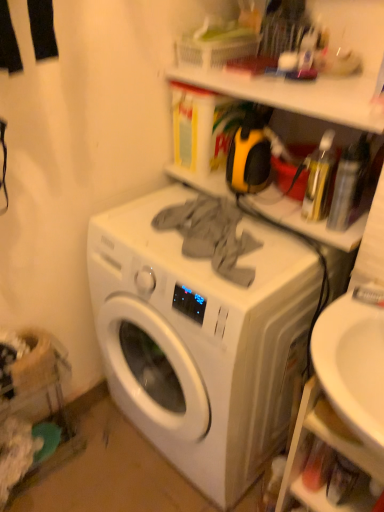
Question: Is white plastic shelf at lower right, the 3th shelf viewed from the top, directly adjacent to matte plastic shelf at upper center, which is counted as the second shelf, starting from the bottom?

Choices:
 (A) no
 (B) yes

Answer: (A)

Question: Does white plastic shelf at lower right, arranged as the 1th shelf when ordered from the bottom, turn towards matte plastic shelf at upper center, the 2th shelf positioned from the top?

Choices:
 (A) yes
 (B) no

Answer: (B)

Question: From a real-world perspective, is white plastic shelf at lower right, the 3th shelf viewed from the top, located higher than matte plastic shelf at upper center, the 2th shelf positioned from the top?

Choices:
 (A) yes
 (B) no

Answer: (B)

Question: Is there a large distance between white plastic shelf at lower right, arranged as the 1th shelf when ordered from the bottom, and matte plastic shelf at upper center, the 2th shelf positioned from the top?

Choices:
 (A) no
 (B) yes

Answer: (A)

Question: From the image's perspective, is white plastic shelf at lower right, arranged as the 1th shelf when ordered from the bottom, under matte plastic shelf at upper center, the 2th shelf positioned from the top?

Choices:
 (A) no
 (B) yes

Answer: (B)

Question: Considering the positions of white matte washing machine at center and white plastic shelf at lower right, arranged as the 1th shelf when ordered from the bottom, in the image, is white matte washing machine at center wider or thinner than white plastic shelf at lower right, arranged as the 1th shelf when ordered from the bottom,?

Choices:
 (A) thin
 (B) wide

Answer: (B)

Question: Is white matte washing machine at center to the left or to the right of white plastic shelf at lower right, the 3th shelf viewed from the top, in the image?

Choices:
 (A) left
 (B) right

Answer: (A)

Question: Is white matte washing machine at center inside or outside of white plastic shelf at lower right, arranged as the 1th shelf when ordered from the bottom?

Choices:
 (A) inside
 (B) outside

Answer: (B)

Question: Considering the positions of white matte washing machine at center and white plastic shelf at lower right, the 3th shelf viewed from the top, in the image, is white matte washing machine at center bigger or smaller than white plastic shelf at lower right, the 3th shelf viewed from the top,?

Choices:
 (A) big
 (B) small

Answer: (A)

Question: Is white plastic shelf at upper center, the third shelf from the bottom, to the left or to the right of white plastic shelf at lower right, the 3th shelf viewed from the top, in the image?

Choices:
 (A) right
 (B) left

Answer: (B)

Question: Looking at their shapes, would you say white plastic shelf at upper center, the third shelf from the bottom, is wider or thinner than white plastic shelf at lower right, the 3th shelf viewed from the top?

Choices:
 (A) thin
 (B) wide

Answer: (B)

Question: From a real-world perspective, is white plastic shelf at upper center, the third shelf from the bottom, above or below white plastic shelf at lower right, the 3th shelf viewed from the top?

Choices:
 (A) above
 (B) below

Answer: (A)

Question: Considering their positions, is white plastic shelf at upper center, arranged as the 1th shelf when viewed from the top, located in front of or behind white plastic shelf at lower right, the 3th shelf viewed from the top?

Choices:
 (A) front
 (B) behind

Answer: (B)

Question: From the image's perspective, relative to white matte washing machine at center, is matte plastic shelf at upper center, which is counted as the second shelf, starting from the bottom, above or below?

Choices:
 (A) below
 (B) above

Answer: (B)

Question: Is matte plastic shelf at upper center, the 2th shelf positioned from the top, taller or shorter than white matte washing machine at center?

Choices:
 (A) tall
 (B) short

Answer: (B)